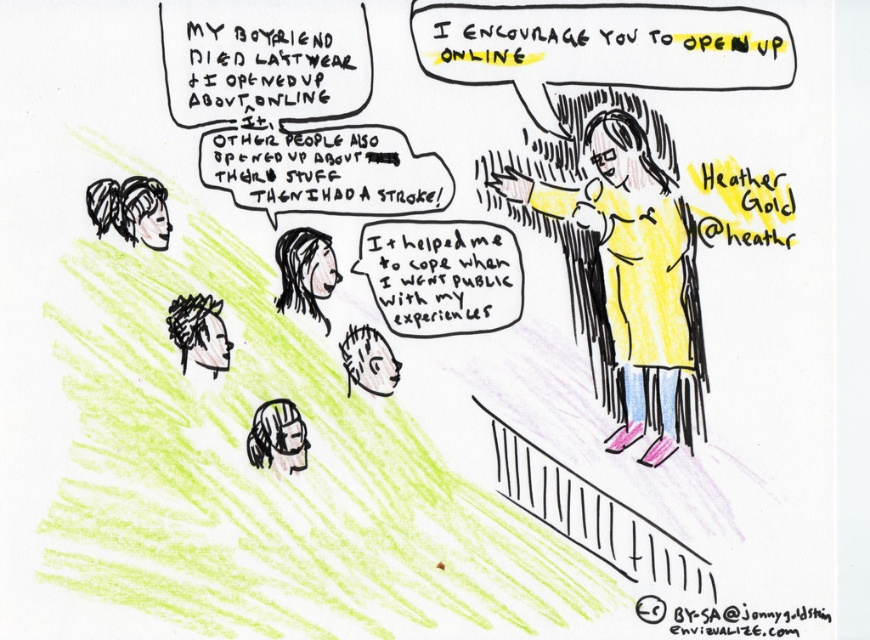
Question: Which of the following is the farthest from the observer?

Choices:
 (A) yellow matte shirt at upper right
 (B) black hair at lower left

Answer: (A)

Question: Which of the following is the farthest from the observer?

Choices:
 (A) yellow matte shirt at upper right
 (B) black hair at upper left

Answer: (A)

Question: Can you confirm if yellow matte shirt at upper right is positioned to the left of white paper at lower center?

Choices:
 (A) yes
 (B) no

Answer: (B)

Question: Can you confirm if smooth white face at center is wider than white paper at lower center?

Choices:
 (A) no
 (B) yes

Answer: (B)

Question: Does smooth white face at center have a greater width compared to white hair at lower left?

Choices:
 (A) yes
 (B) no

Answer: (A)

Question: Among these objects, which one is farthest from the camera?

Choices:
 (A) yellow matte shirt at upper right
 (B) white paper at lower center
 (C) black hair at upper left

Answer: (B)